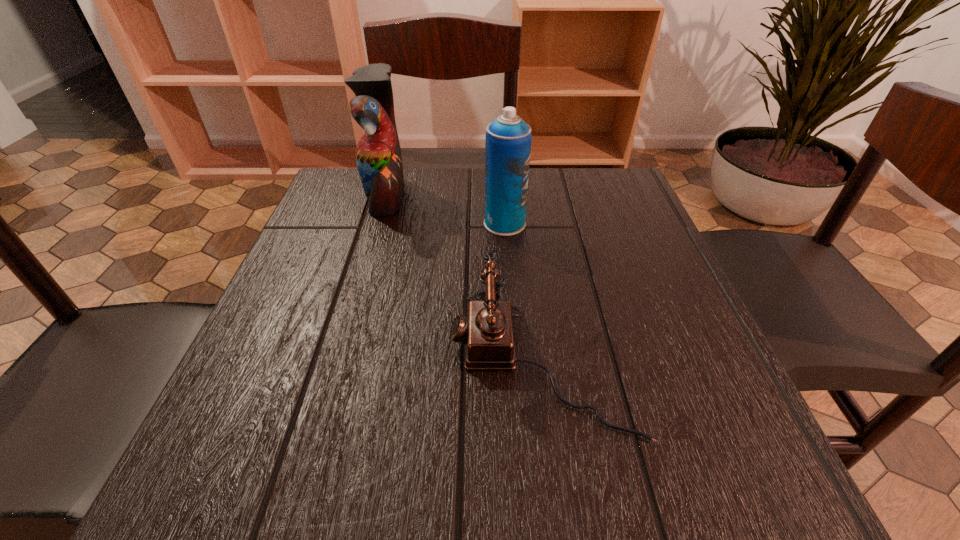
Locate an element on the screen. This screenshot has height=540, width=960. the leftmost object is located at coordinates (378, 155).

The height and width of the screenshot is (540, 960). What are the coordinates of `aerosol can` in the screenshot? It's located at (508, 140).

Image resolution: width=960 pixels, height=540 pixels. What are the coordinates of `the shortest object` in the screenshot? It's located at (487, 332).

You are a GUI agent. You are given a task and a screenshot of the screen. Output one action in this format:
    pyautogui.click(x=<x>, y=<y>)
    Task: Click on the telephone
    This screenshot has width=960, height=540.
    Given the screenshot: What is the action you would take?
    pyautogui.click(x=487, y=332)

Image resolution: width=960 pixels, height=540 pixels. Find the location of `vacant point located at the face of the parrot`. vacant point located at the face of the parrot is located at coordinates (542, 195).

At what (x,y) coordinates should I click in order to perform the action: click on vacant space located on the back of the aerosol can. Please return your answer as a coordinate pair (x, y). Looking at the image, I should click on (502, 193).

Where is `vacant space located 0.130m on the dial of the shortest object`? This screenshot has height=540, width=960. vacant space located 0.130m on the dial of the shortest object is located at coordinates (367, 359).

Locate an element on the screen. The width and height of the screenshot is (960, 540). free space located on the dial of the shortest object is located at coordinates (398, 359).

Locate an element on the screen. The width and height of the screenshot is (960, 540). free location located 0.120m on the dial of the shortest object is located at coordinates pos(372,359).

This screenshot has height=540, width=960. What are the coordinates of `parrot at the far edge` in the screenshot? It's located at (378, 155).